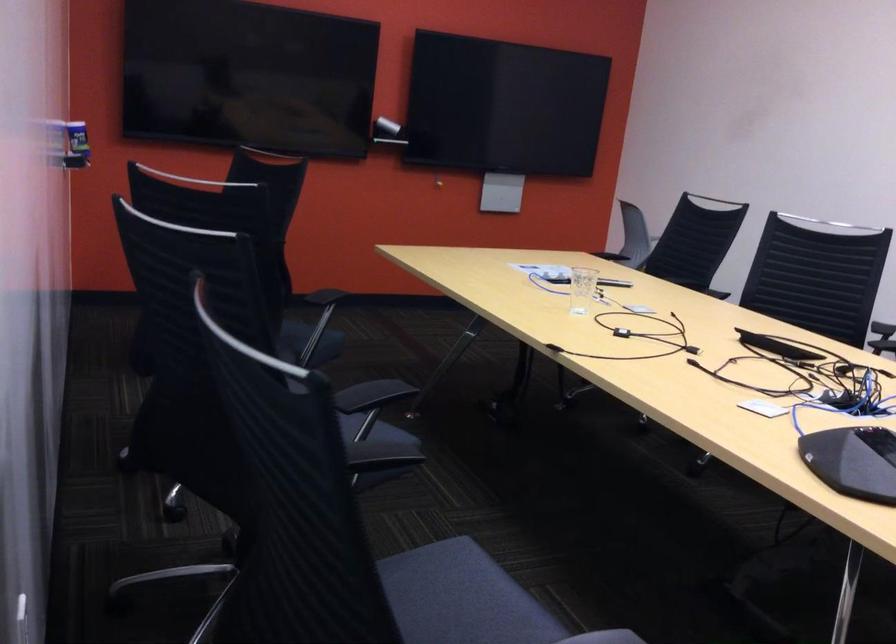
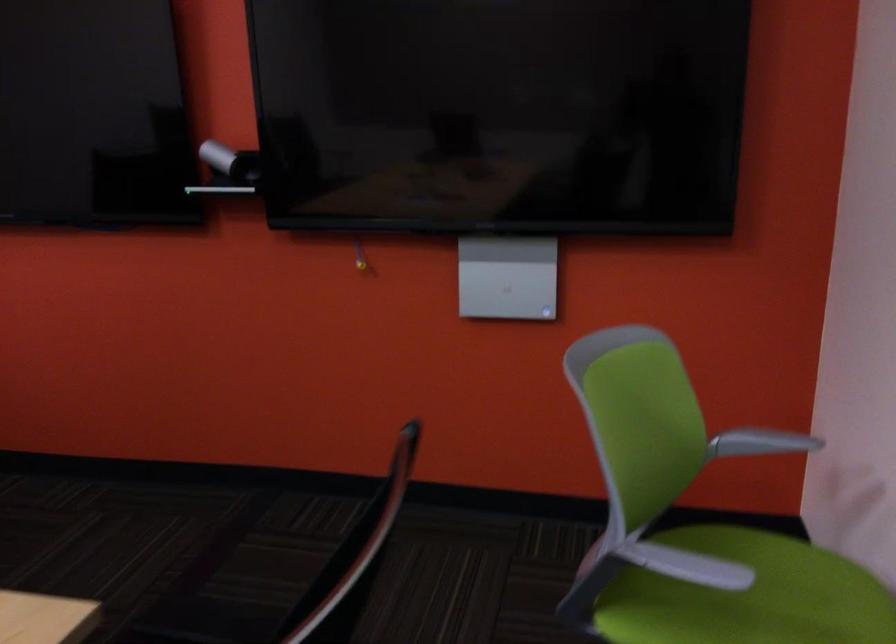
Locate, in the second image, the point that corresponds to (x=409, y=111) in the first image.

(230, 162)